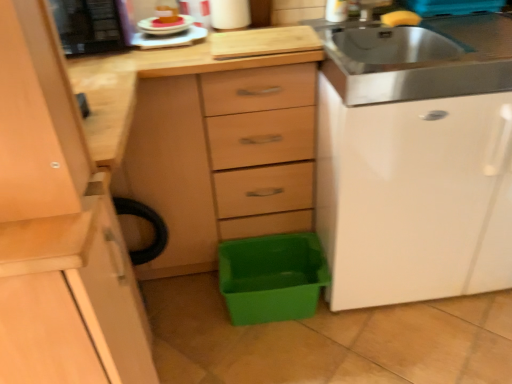
Question: Visually, is black plastic microwave at upper left, which ranks as the 2th appliance in right-to-left order, positioned to the left or to the right of pink frosted cake at upper left, placed as the second food when sorted from right to left?

Choices:
 (A) left
 (B) right

Answer: (A)

Question: Looking at the image, does black plastic microwave at upper left, marked as the first appliance in a left-to-right arrangement, seem bigger or smaller compared to pink frosted cake at upper left, placed as the second food when sorted from right to left?

Choices:
 (A) small
 (B) big

Answer: (B)

Question: Which object is positioned farthest from the matte wood chest of drawers at center?

Choices:
 (A) green plastic storage box at lower center
 (B) stainless steel sink at upper right
 (C) white glossy file cabinet at right
 (D) yellow sponge at upper right, which ranks as the 1th food in right-to-left order
 (E) pink frosted cake at upper left, placed as the second food when sorted from right to left

Answer: (D)

Question: Which object is positioned closest to the white glossy file cabinet at right?

Choices:
 (A) green plastic storage box at lower center
 (B) matte wood chest of drawers at center
 (C) white glossy plate at upper center, which is counted as the second appliance, starting from the left
 (D) stainless steel sink at upper right
 (E) black plastic microwave at upper left, which ranks as the 2th appliance in right-to-left order

Answer: (A)